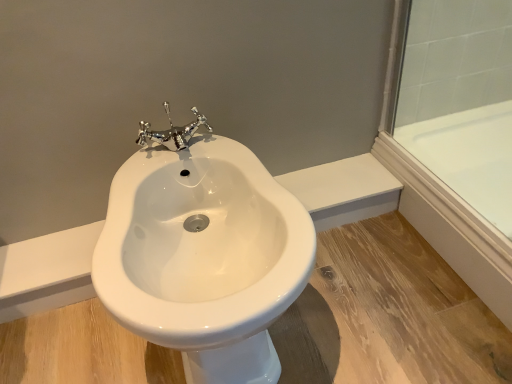
Question: Is white glossy bidet at center completely or partially inside transparent glass door at upper right?

Choices:
 (A) no
 (B) yes

Answer: (A)

Question: Can you confirm if transparent glass door at upper right is taller than white glossy bidet at center?

Choices:
 (A) yes
 (B) no

Answer: (B)

Question: Is transparent glass door at upper right to the right of white glossy bidet at center from the viewer's perspective?

Choices:
 (A) yes
 (B) no

Answer: (A)

Question: Is transparent glass door at upper right smaller than white glossy bidet at center?

Choices:
 (A) no
 (B) yes

Answer: (B)

Question: Considering the relative sizes of transparent glass door at upper right and white glossy bidet at center in the image provided, is transparent glass door at upper right wider than white glossy bidet at center?

Choices:
 (A) no
 (B) yes

Answer: (A)

Question: Is transparent glass door at upper right behind white glossy bidet at center?

Choices:
 (A) no
 (B) yes

Answer: (B)

Question: Is white glossy bidet at center closer to camera compared to transparent glass door at upper right?

Choices:
 (A) no
 (B) yes

Answer: (B)

Question: Does white glossy bidet at center have a larger size compared to transparent glass door at upper right?

Choices:
 (A) no
 (B) yes

Answer: (B)

Question: From the image's perspective, would you say white glossy bidet at center is shown under transparent glass door at upper right?

Choices:
 (A) yes
 (B) no

Answer: (A)

Question: Is white glossy bidet at center in contact with transparent glass door at upper right?

Choices:
 (A) yes
 (B) no

Answer: (B)

Question: Is white glossy bidet at center to the right of transparent glass door at upper right from the viewer's perspective?

Choices:
 (A) yes
 (B) no

Answer: (B)

Question: Does white glossy bidet at center have a smaller size compared to transparent glass door at upper right?

Choices:
 (A) no
 (B) yes

Answer: (A)

Question: Considering their positions, is white glossy bidet at center located in front of or behind transparent glass door at upper right?

Choices:
 (A) behind
 (B) front

Answer: (B)